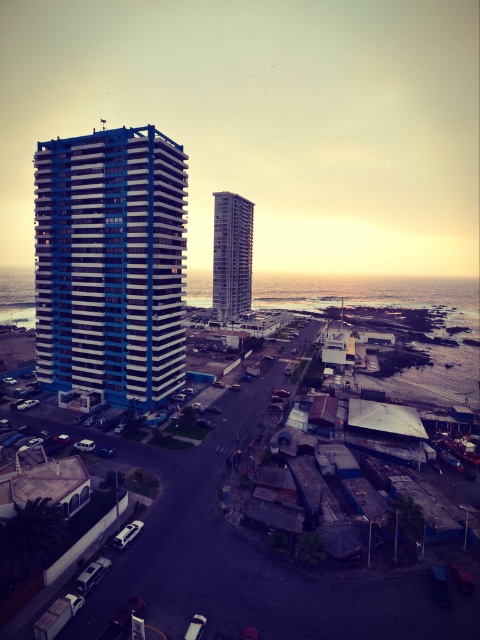
You are standing at the T junction in the coastal town and want to take a photo of both the point at coordinates (158, 305) and the point at (245, 212). Which point will appear larger in your camera view?

Point (158, 305) will appear larger in the camera view because it is closer to the viewer than point (245, 212).

You are a drone operator who needs to capture aerial footage of the blue glossy building at center. Your drone can fly up to 100 meters away from you. Based on the scene, will your drone be able to reach the building?

The blue glossy building at center is 105.26 meters away from the camera, which exceeds the drone operator can fly up to 100 meters. Therefore, the drone cannot reach the building.

You are a city planner analyzing the layout of this coastal area. You need to determine which building, the blue glossy building at center or the smooth glass building at center, occupies more horizontal space along the road. Based on the scene, which one is wider?

The blue glossy building at center is wider than the smooth glass building at center, as its width surpasses the latter according to the description.